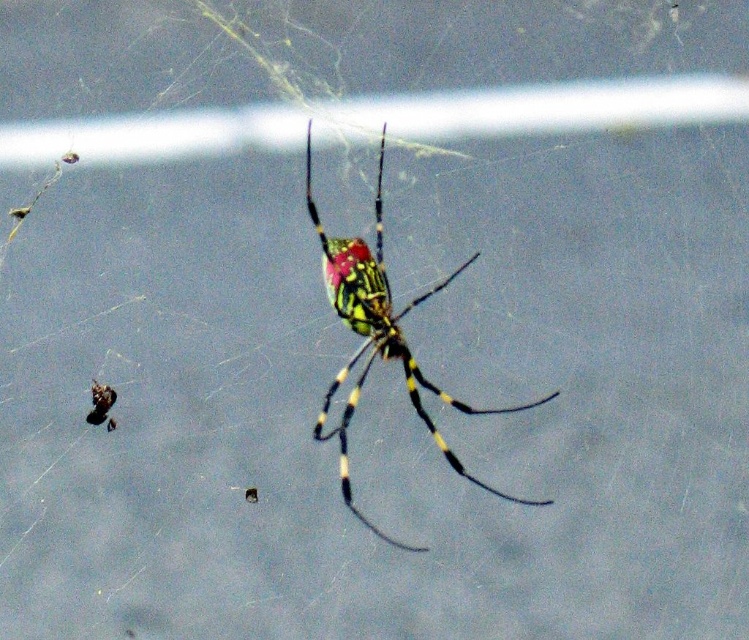
Question: Which point appears farthest from the camera in this image?

Choices:
 (A) (380, 148)
 (B) (112, 429)

Answer: (A)

Question: Does multicolored glossy spider at center have a larger size compared to shiny black insect at lower left?

Choices:
 (A) no
 (B) yes

Answer: (B)

Question: Where is multicolored glossy spider at center located in relation to shiny black insect at lower left in the image?

Choices:
 (A) right
 (B) left

Answer: (A)

Question: Can you confirm if multicolored glossy spider at center is thinner than shiny black insect at lower left?

Choices:
 (A) yes
 (B) no

Answer: (B)

Question: Which object appears farthest from the camera in this image?

Choices:
 (A) multicolored glossy spider at center
 (B) shiny black insect at lower left

Answer: (B)

Question: Which point appears farthest from the camera in this image?

Choices:
 (A) (106, 412)
 (B) (398, 348)

Answer: (B)